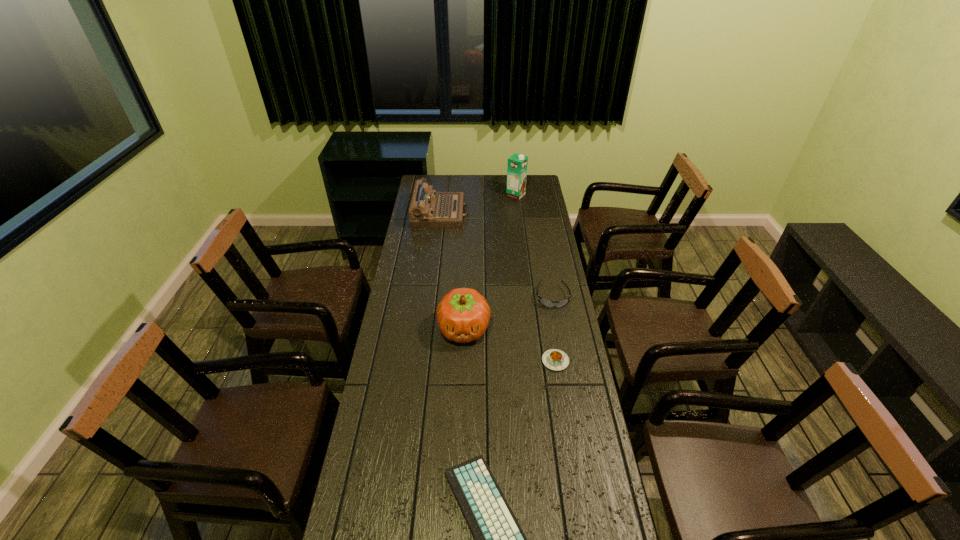
Identify which object is the fifth closest to the carton. Please provide its 2D coordinates. Your answer should be formatted as a tuple, i.e. [(x, y)], where the tuple contains the x and y coordinates of a point satisfying the conditions above.

[(498, 538)]

Where is `free location that satisfies the following two spatial constraints: 1. on the front side of the tallest object; 2. on the right side of the pudding`? free location that satisfies the following two spatial constraints: 1. on the front side of the tallest object; 2. on the right side of the pudding is located at coordinates (536, 361).

This screenshot has height=540, width=960. I want to click on free spot that satisfies the following two spatial constraints: 1. on the keyboard of the pudding; 2. on the left side of the third tallest object, so click(422, 361).

You are a GUI agent. You are given a task and a screenshot of the screen. Output one action in this format:
    pyautogui.click(x=<x>, y=<y>)
    Task: Click on the blank space that satisfies the following two spatial constraints: 1. on the side of the pudding with the cute face; 2. on the right side of the pumpkin
    The width and height of the screenshot is (960, 540).
    Given the screenshot: What is the action you would take?
    pyautogui.click(x=463, y=361)